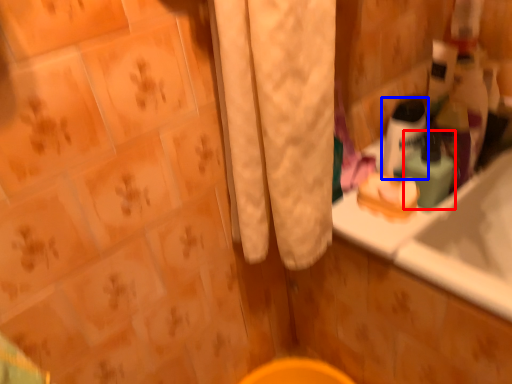
Question: Among these objects, which one is farthest to the camera, mouthwash (highlighted by a red box) or mouthwash (highlighted by a blue box)?

Choices:
 (A) mouthwash
 (B) mouthwash

Answer: (B)